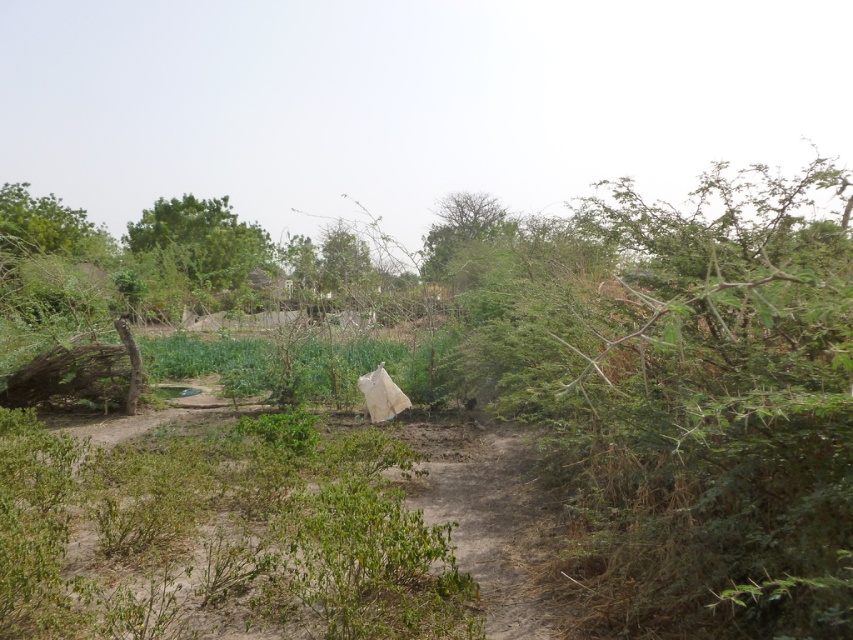
Can you confirm if green leafy tree at upper left is taller than green leafy tree at center?

No, green leafy tree at upper left is not taller than green leafy tree at center.

Locate an element on the screen. The height and width of the screenshot is (640, 853). green leafy tree at upper left is located at coordinates (202, 237).